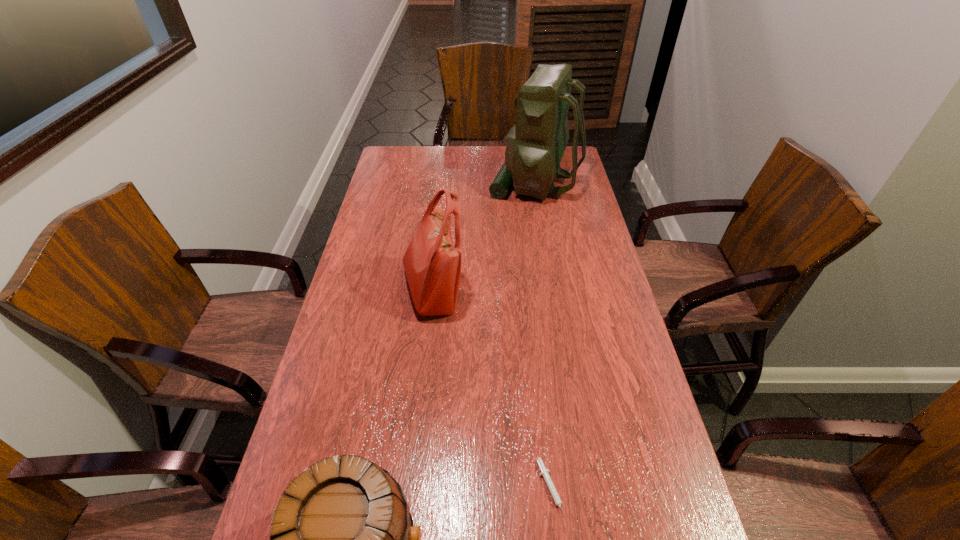
At what (x,y) coordinates should I click in order to perform the action: click on free area in between the farthest object and the handbag. Please return your answer as a coordinate pair (x, y). Image resolution: width=960 pixels, height=540 pixels. Looking at the image, I should click on (484, 237).

You are a GUI agent. You are given a task and a screenshot of the screen. Output one action in this format:
    pyautogui.click(x=<x>, y=<y>)
    Task: Click on the unoccupied position between the syringe and the third shortest object
    This screenshot has height=540, width=960.
    Given the screenshot: What is the action you would take?
    pyautogui.click(x=492, y=390)

The height and width of the screenshot is (540, 960). I want to click on free point between the second tallest object and the syringe, so click(x=492, y=390).

This screenshot has height=540, width=960. I want to click on object that stands as the second closest to the third nearest object, so click(545, 473).

Locate which object ranks in proximity to the shortest object. Please provide its 2D coordinates. Your answer should be formatted as a tuple, i.e. [(x, y)], where the tuple contains the x and y coordinates of a point satisfying the conditions above.

[(342, 539)]

You are a GUI agent. You are given a task and a screenshot of the screen. Output one action in this format:
    pyautogui.click(x=<x>, y=<y>)
    Task: Click on the free space that satisfies the following two spatial constraints: 1. on the front-facing side of the second farthest object; 2. on the right side of the syringe
    The image size is (960, 540).
    Given the screenshot: What is the action you would take?
    pyautogui.click(x=412, y=490)

Where is `free space that satisfies the following two spatial constraints: 1. on the front-facing side of the second farthest object; 2. on the left side of the shortest object`? free space that satisfies the following two spatial constraints: 1. on the front-facing side of the second farthest object; 2. on the left side of the shortest object is located at coordinates (412, 490).

I want to click on free location that satisfies the following two spatial constraints: 1. on the front-facing side of the syringe; 2. on the right side of the third nearest object, so click(412, 490).